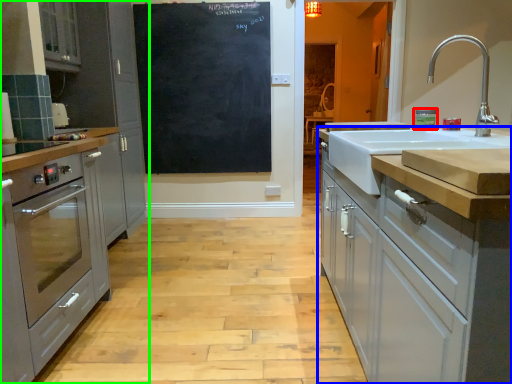
Question: Considering the real-world distances, which object is closest to appliance (highlighted by a red box)? cabinetry (highlighted by a blue box) or cabinetry (highlighted by a green box).

Choices:
 (A) cabinetry
 (B) cabinetry

Answer: (A)